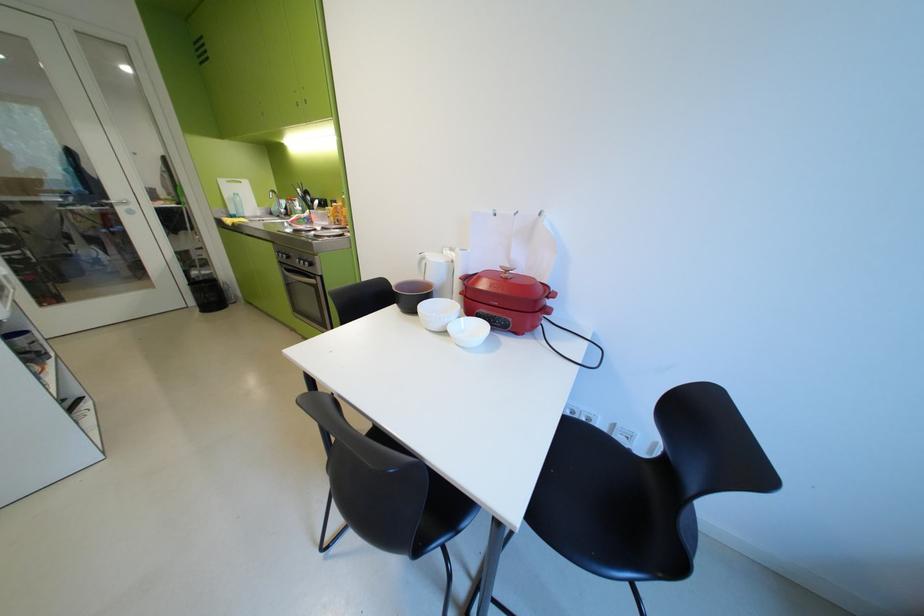
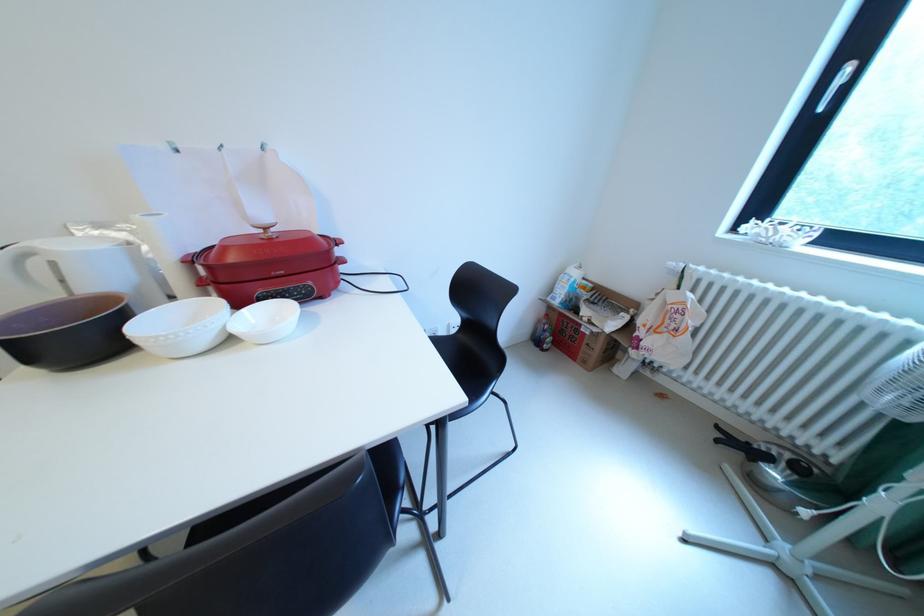
The point at [514,276] is marked in the first image. Where is the corresponding point in the second image?

(273, 237)